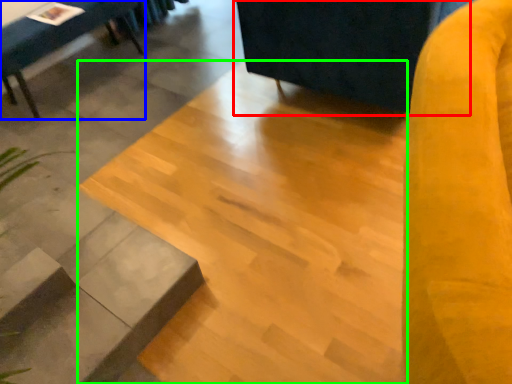
Question: Based on their relative distances, which object is nearer to swivel chair (highlighted by a red box)? Choose from furniture (highlighted by a blue box) and concrete (highlighted by a green box).

Choices:
 (A) furniture
 (B) concrete

Answer: (B)